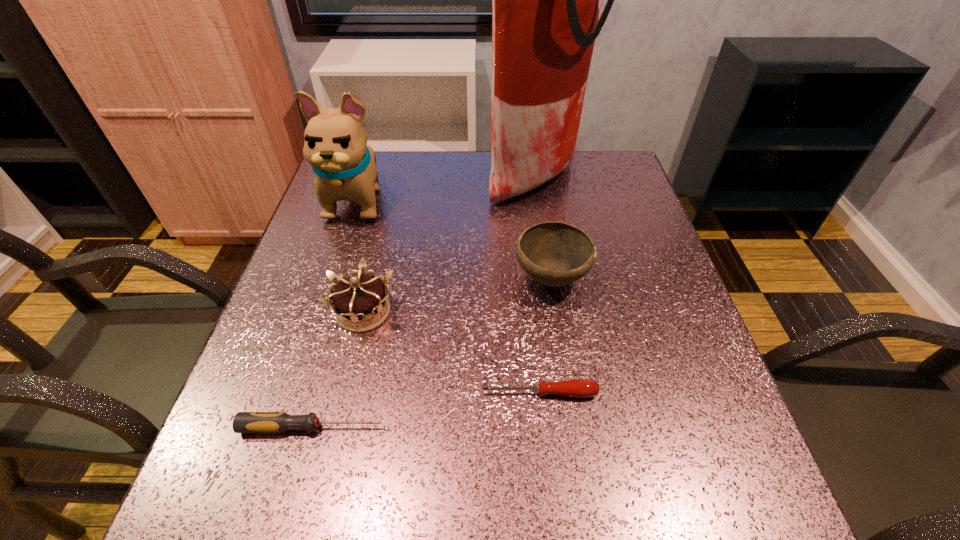
At what (x,y) coordinates should I click in order to perform the action: click on free space that satisfies the following two spatial constraints: 1. on the front side of the right screwdriver; 2. insert the nearer screwdriver into a screw head. Please return your answer as a coordinate pair (x, y). The width and height of the screenshot is (960, 540). Looking at the image, I should click on (542, 427).

The width and height of the screenshot is (960, 540). I want to click on vacant space that satisfies the following two spatial constraints: 1. on the face of the fifth farthest object; 2. on the right side of the second tallest object, so click(x=295, y=393).

This screenshot has height=540, width=960. In order to click on free region that satisfies the following two spatial constraints: 1. on the face of the puppy; 2. on the left side of the bowl in this screenshot , I will do `click(331, 278)`.